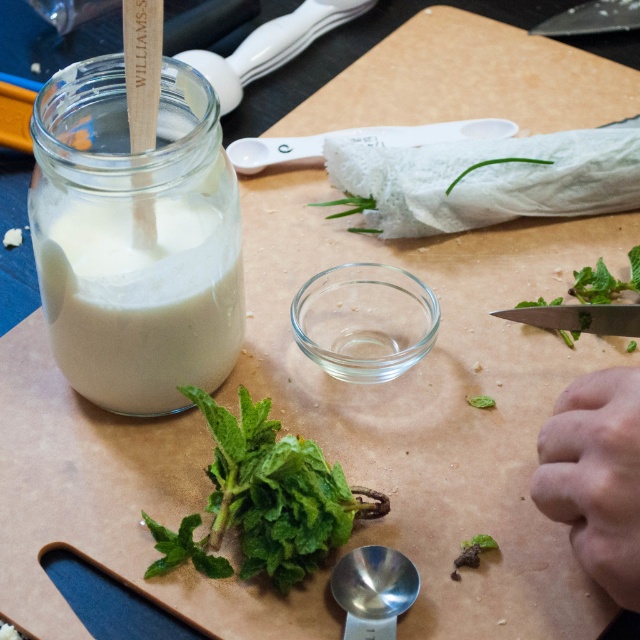
What are the coordinates of the white matte jar at left?

The white matte jar at left is located at coordinates point (141, 301).

You are standing in front of the kitchen workspace. There are two points marked on the image. The first point is at coordinate point (227, 442) and the second is at point (611, 525). If you were to reach out and touch these points, which one would feel closer to your hand?

Point (227, 442) is further to the camera than point (611, 525), so when you reach out, the point (227, 442) will feel closer to your hand because it is nearer to you.